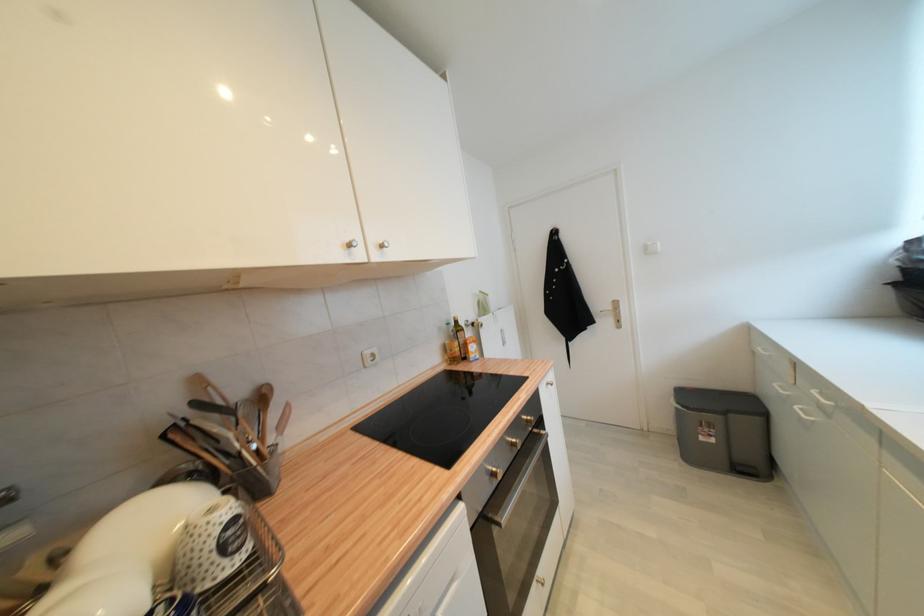
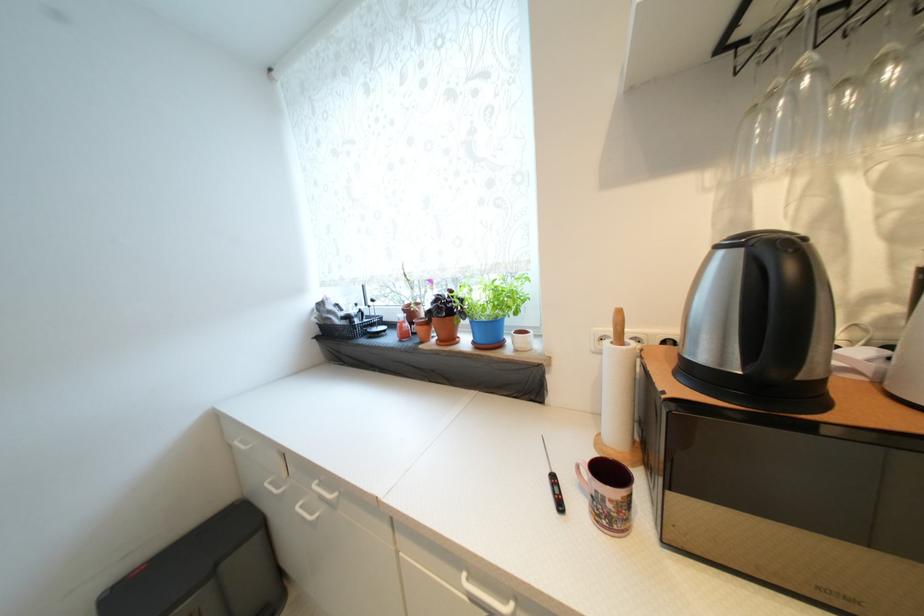
In the second image, find the point that corresponds to the point at 764,352 in the first image.

(242, 445)